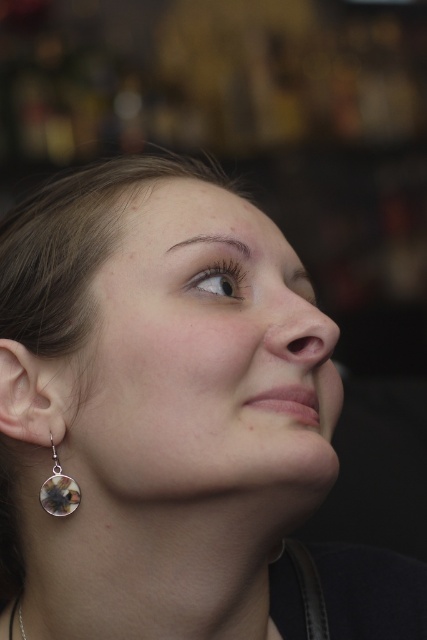
Is brown matte eye at upper right bigger than multicolored glass earring at lower left?

Yes, brown matte eye at upper right is bigger than multicolored glass earring at lower left.

Is brown matte eye at upper right below multicolored glass earring at lower left?

Actually, brown matte eye at upper right is above multicolored glass earring at lower left.

Does point (225, 291) lie behind point (64, 499)?

Yes, point (225, 291) is farther from viewer.

Identify the location of brown matte eye at upper right. (219, 280).